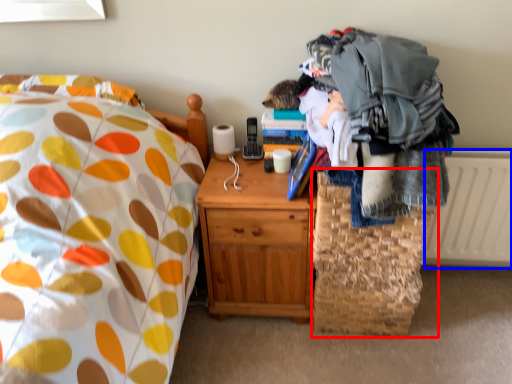
Question: Which object appears farthest to the camera in this image, basket (highlighted by a red box) or radiator (highlighted by a blue box)?

Choices:
 (A) basket
 (B) radiator

Answer: (B)